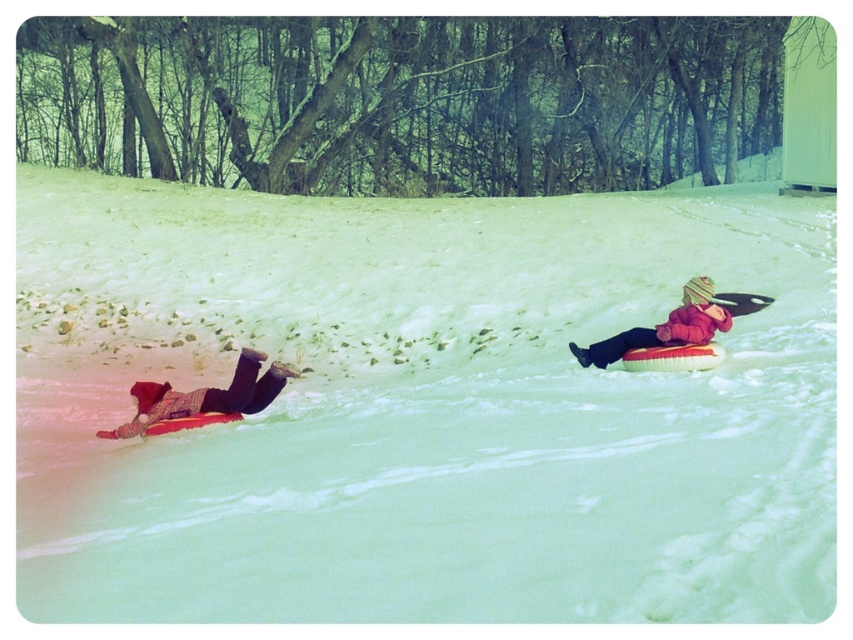
You are standing at the camera position and want to reach the point at coordinates (119, 435). If your walking speed is 1.5 meters per second, how many seconds will it take you to reach that point?

The point at coordinates (119, 435) is 10.21 meters away from the camera. At a walking speed of 1.5 meters per second, it would take approximately 6.8 seconds to reach it.

You are a photographer trying to capture a clear shot of both the white fluffy snow at center and the red fuzzy winter hat at upper right. Since you want both objects in focus, which one should you adjust your camera focus to prioritize? Please explain your reasoning based on their positions.

You should prioritize focusing on the white fluffy snow at center because it is closer to the viewer than the red fuzzy winter hat at upper right. In photography, focusing on the closer object ensures it remains sharp, and the background object may still be in acceptable focus depending on the depth of field.

In the scene shown: You are planning to build a snowman using the white fluffy snow at center and the red fuzzy winter hat at upper right. Which object is wider so that it can be used as the base of the snowman?

The white fluffy snow at center is wider than the red fuzzy winter hat at upper right, so it can be used as the base of the snowman.